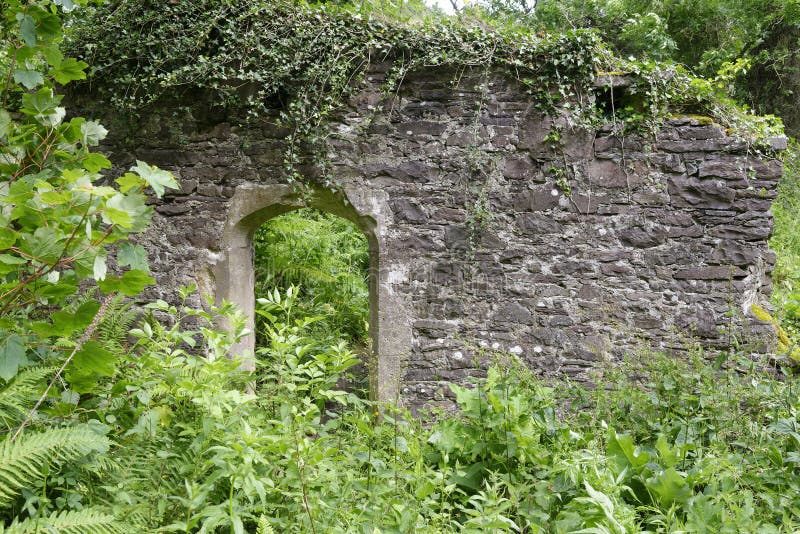
This screenshot has width=800, height=534. Identify the location of doorway. (310, 265).